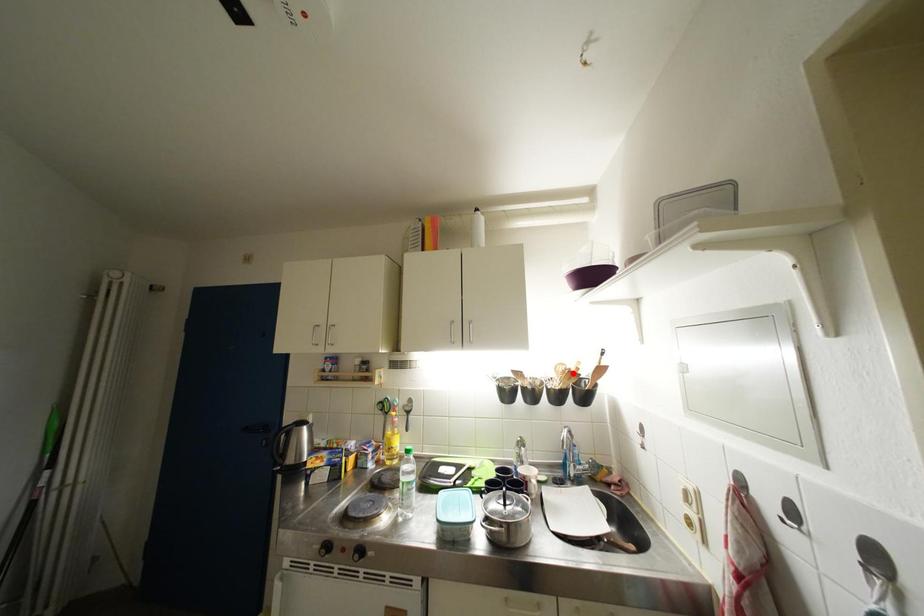
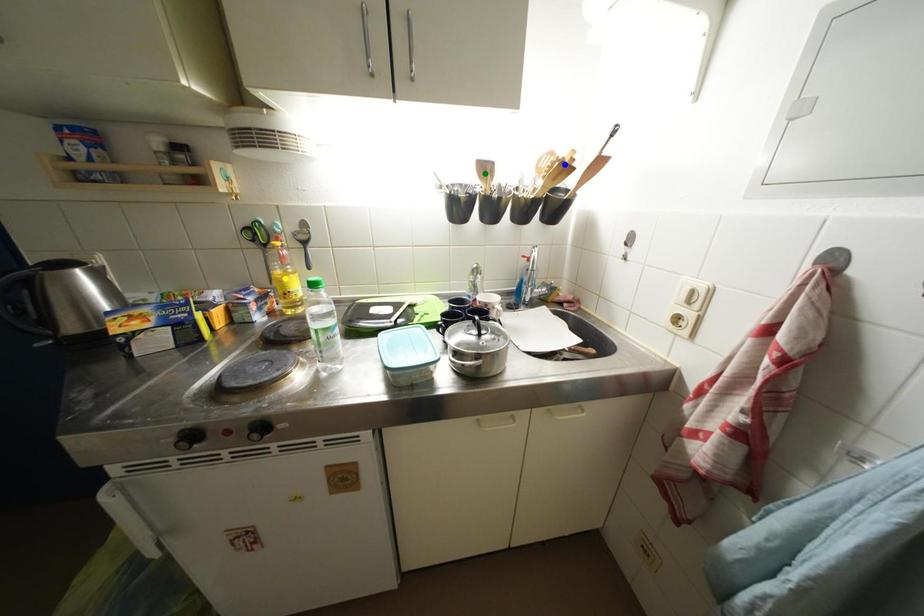
Question: I am providing you with two images of the same scene from different viewpoints. A red point is marked on the first image. You are given multiple points on the second image. Which spot in image 2 lines up with the point in image 1?

Choices:
 (A) green point
 (B) yellow point
 (C) blue point

Answer: (C)